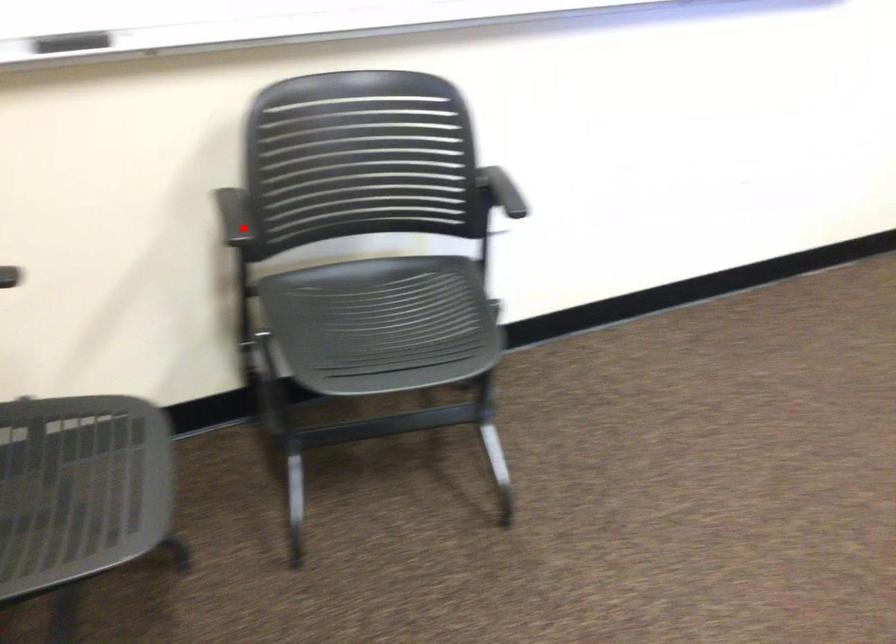
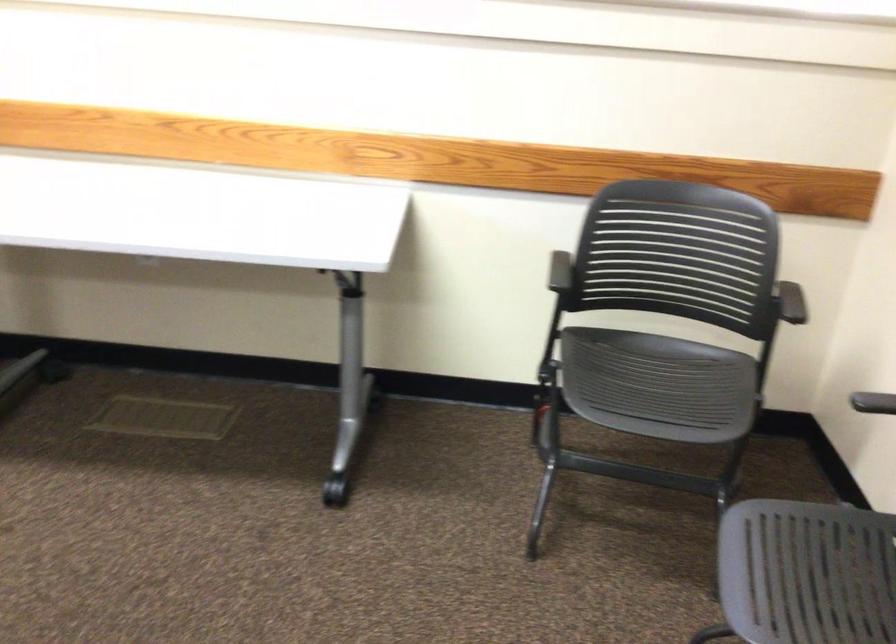
In the second image, find the point that corresponds to the highlighted location in the first image.

(873, 402)